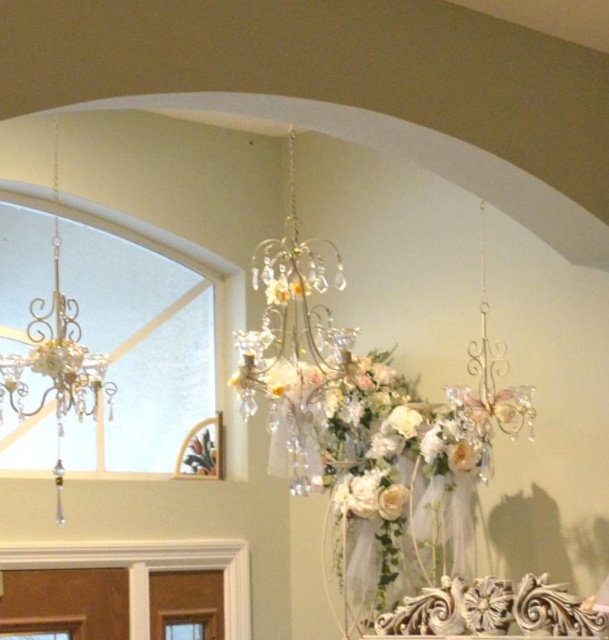
Does silver metallic chandelier at center lie behind matte gold chandelier at left?

Yes, silver metallic chandelier at center is behind matte gold chandelier at left.

Image resolution: width=609 pixels, height=640 pixels. What do you see at coordinates (292, 342) in the screenshot?
I see `silver metallic chandelier at center` at bounding box center [292, 342].

Who is more distant from viewer, (273, 352) or (2, 365)?

Point (273, 352)

The image size is (609, 640). Identify the location of silver metallic chandelier at center. (292, 342).

Is point (361, 406) in front of point (71, 392)?

No.

Between ivory silk floral arrangement at center and matte gold chandelier at left, which one is positioned lower?

ivory silk floral arrangement at center is below.

This screenshot has height=640, width=609. What do you see at coordinates (395, 486) in the screenshot?
I see `ivory silk floral arrangement at center` at bounding box center [395, 486].

Locate an element on the screen. This screenshot has width=609, height=640. ivory silk floral arrangement at center is located at coordinates (395, 486).

Who is more forward, (409, 426) or (300, 324)?

Point (300, 324) is in front.

Is ivory silk floral arrangement at center smaller than silver metallic chandelier at center?

No.

Find the location of a particular element. Image resolution: width=609 pixels, height=640 pixels. ivory silk floral arrangement at center is located at coordinates (395, 486).